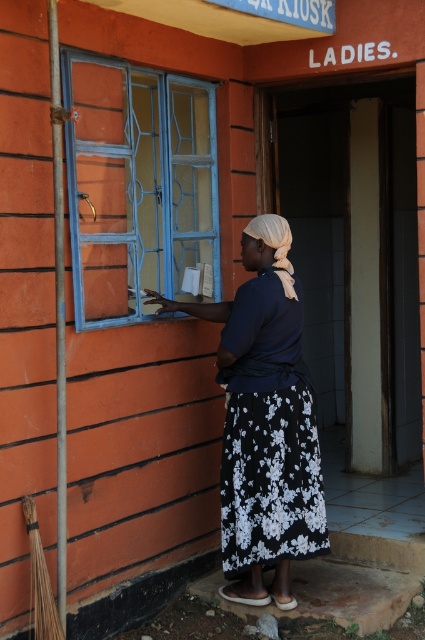
Question: Among these points, which one is farthest from the camera?

Choices:
 (A) (224, 500)
 (B) (263, 563)
 (C) (76, 134)

Answer: (A)

Question: Which of the following is the closest to the observer?

Choices:
 (A) blue painted glass window at left
 (B) black floral fabric dress at center
 (C) black floral skirt at center

Answer: (A)

Question: Does blue painted glass window at left appear under black floral fabric dress at center?

Choices:
 (A) no
 (B) yes

Answer: (A)

Question: Which of the following is the farthest from the observer?

Choices:
 (A) (316, 490)
 (B) (172, 266)

Answer: (B)

Question: Is blue painted glass window at left thinner than black floral skirt at center?

Choices:
 (A) yes
 (B) no

Answer: (B)

Question: Is blue painted glass window at left to the left of black floral fabric dress at center from the viewer's perspective?

Choices:
 (A) no
 (B) yes

Answer: (B)